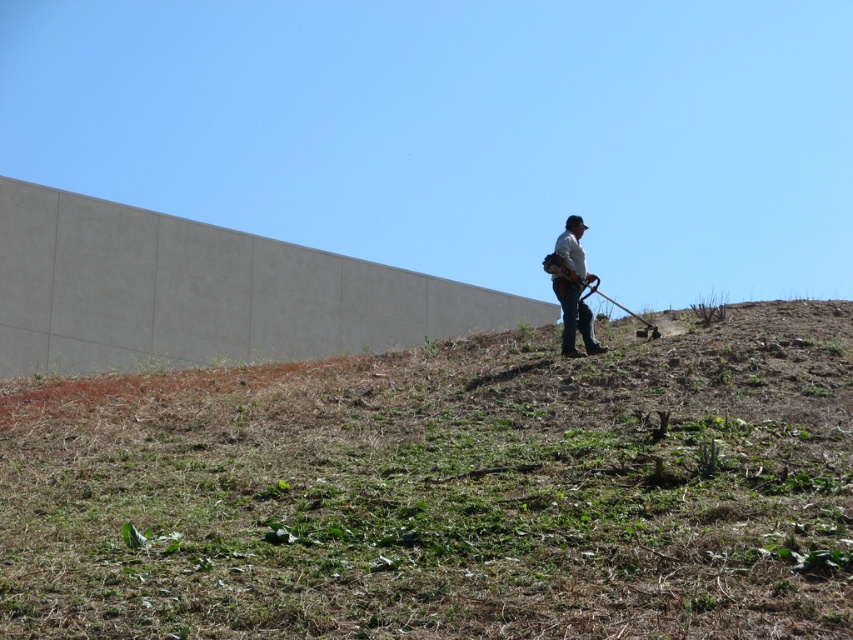
Question: Does green grassy at upper center have a smaller size compared to white fabric shirt at center?

Choices:
 (A) no
 (B) yes

Answer: (A)

Question: Which object is farther from the camera taking this photo?

Choices:
 (A) green grassy at upper center
 (B) white fabric shirt at center

Answer: (B)

Question: Does green grassy at upper center have a lesser width compared to white fabric shirt at center?

Choices:
 (A) no
 (B) yes

Answer: (A)

Question: Which point is closer to the camera taking this photo?

Choices:
 (A) (572, 216)
 (B) (471, 390)

Answer: (B)

Question: Which of the following is the farthest from the observer?

Choices:
 (A) (672, 531)
 (B) (575, 305)

Answer: (B)

Question: Does green grassy at upper center appear under white fabric shirt at center?

Choices:
 (A) yes
 (B) no

Answer: (A)